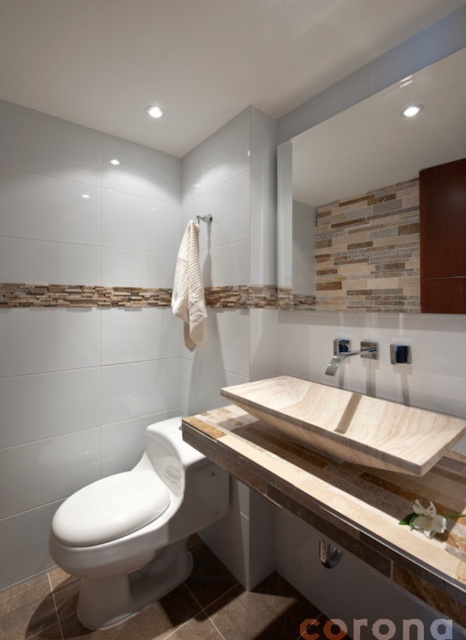
Question: Which of these objects is positioned closest to the light brown marble vanity at lower right?

Choices:
 (A) light wood/wooden sink at center
 (B) white ceramic shower at upper center
 (C) wooden frame mirror at upper center

Answer: (A)

Question: Does wooden frame mirror at upper center appear over light wood/wooden sink at center?

Choices:
 (A) yes
 (B) no

Answer: (A)

Question: Which point appears closest to the camera in this image?

Choices:
 (A) (210, 214)
 (B) (369, 248)
 (C) (128, 481)

Answer: (B)

Question: Is light wood/wooden sink at center closer to the viewer compared to satin nickel faucet at upper center?

Choices:
 (A) yes
 (B) no

Answer: (A)

Question: Which object is the farthest from the white glossy toilet bowl at lower left?

Choices:
 (A) light brown marble vanity at lower right
 (B) light wood/wooden sink at center

Answer: (B)

Question: Does light brown marble vanity at lower right appear under satin nickel faucet at upper center?

Choices:
 (A) no
 (B) yes

Answer: (B)